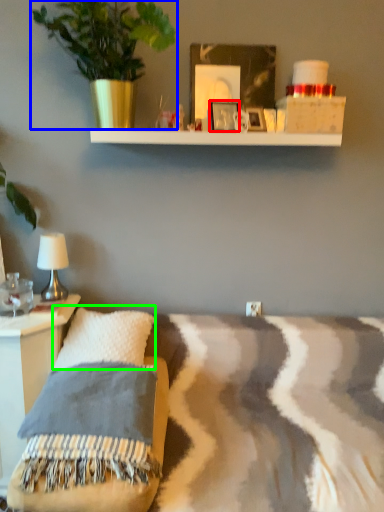
Question: Based on their relative distances, which object is nearer to picture frame (highlighted by a red box)? Choose from houseplant (highlighted by a blue box) and pillow (highlighted by a green box).

Choices:
 (A) houseplant
 (B) pillow

Answer: (A)